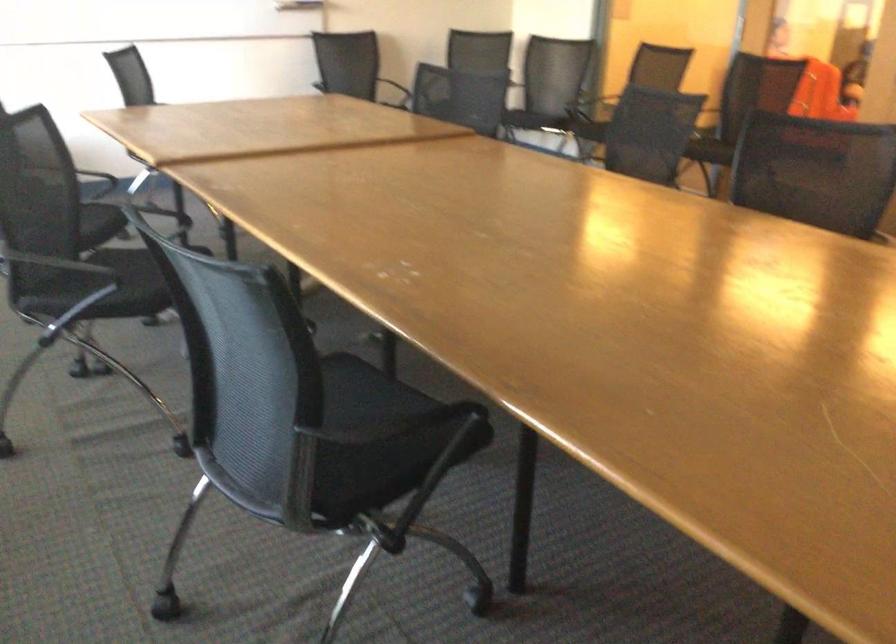
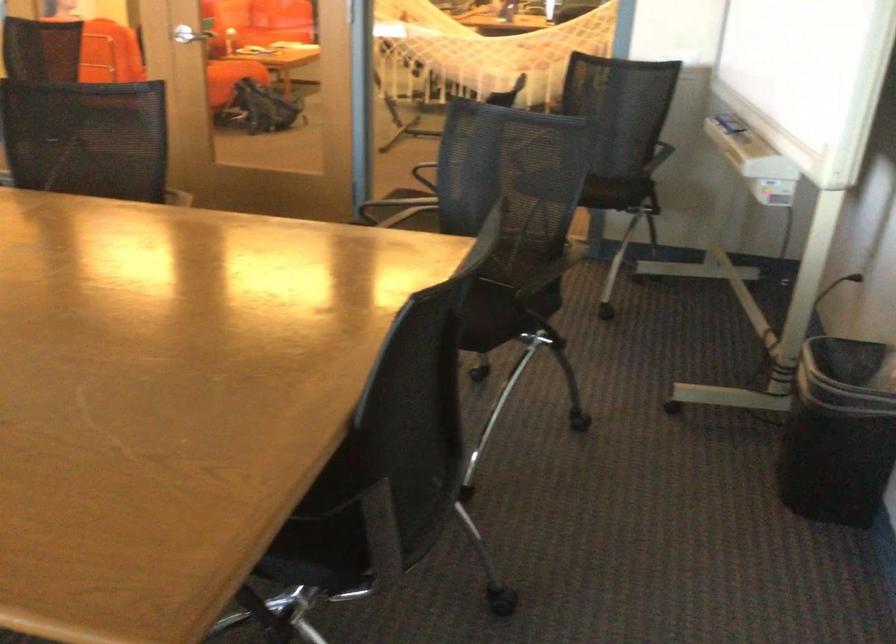
Question: The first image is from the beginning of the video and the second image is from the end. How did the camera likely rotate when shooting the video?

Choices:
 (A) Left
 (B) Right
 (C) Up
 (D) Down

Answer: (B)